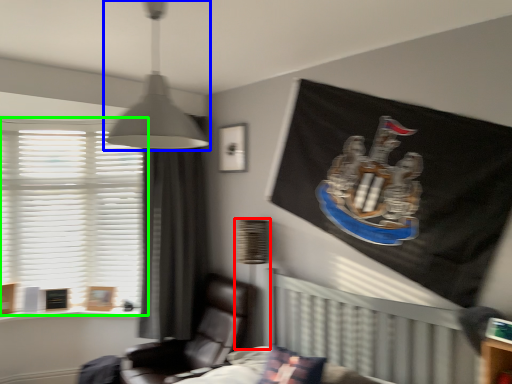
Question: Which is farther away from table lamp (highlighted by a red box)? lamp (highlighted by a blue box) or window (highlighted by a green box)?

Choices:
 (A) lamp
 (B) window

Answer: (B)